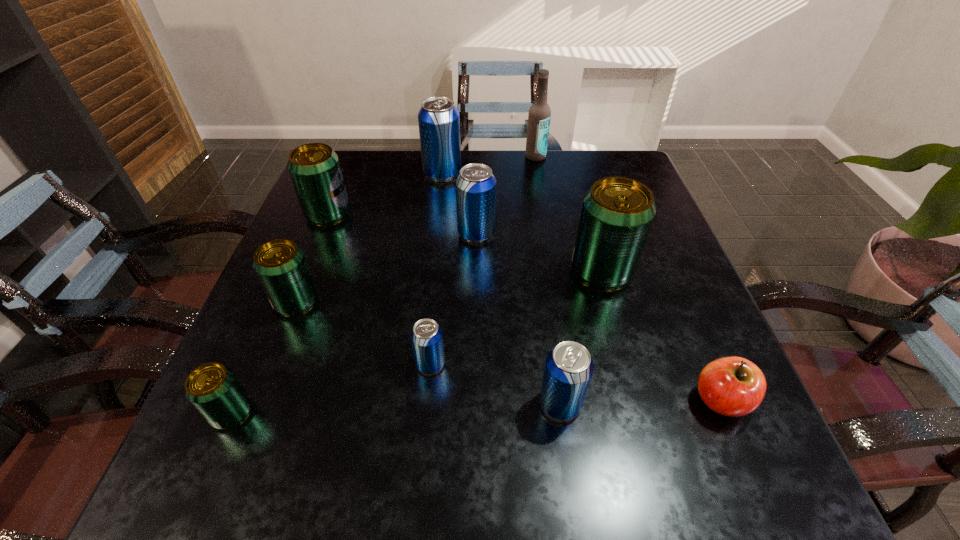
Identify which blue beer can is the third closest to the farthest object. Please provide its 2D coordinates. Your answer should be formatted as a tuple, i.e. [(x, y)], where the tuple contains the x and y coordinates of a point satisfying the conditions above.

[(426, 335)]

Identify which green beer can is located as the fourth nearest to the nearest blue beer can. Please provide its 2D coordinates. Your answer should be formatted as a tuple, i.e. [(x, y)], where the tuple contains the x and y coordinates of a point satisfying the conditions above.

[(314, 168)]

Identify which green beer can is located as the fourth nearest to the seventh beer can from left to right. Please provide its 2D coordinates. Your answer should be formatted as a tuple, i.e. [(x, y)], where the tuple contains the x and y coordinates of a point satisfying the conditions above.

[(314, 168)]

You are a GUI agent. You are given a task and a screenshot of the screen. Output one action in this format:
    pyautogui.click(x=<x>, y=<y>)
    Task: Click on the vacant region that satisfies the following two spatial constraints: 1. on the front side of the rightmost object; 2. on the right side of the fourth nearest object
    The height and width of the screenshot is (540, 960).
    Given the screenshot: What is the action you would take?
    pyautogui.click(x=427, y=400)

This screenshot has width=960, height=540. Find the location of `free space that satisfies the following two spatial constraints: 1. on the front side of the seventh farthest object; 2. on the right side of the farthest blue beer can`. free space that satisfies the following two spatial constraints: 1. on the front side of the seventh farthest object; 2. on the right side of the farthest blue beer can is located at coordinates (421, 363).

Find the location of a particular element. free space that satisfies the following two spatial constraints: 1. on the label of the beer bottle; 2. on the right side of the second object from right to left is located at coordinates (556, 271).

Locate an element on the screen. The width and height of the screenshot is (960, 540). blank area in the image that satisfies the following two spatial constraints: 1. on the back side of the smallest green beer can; 2. on the left side of the rightmost object is located at coordinates (237, 400).